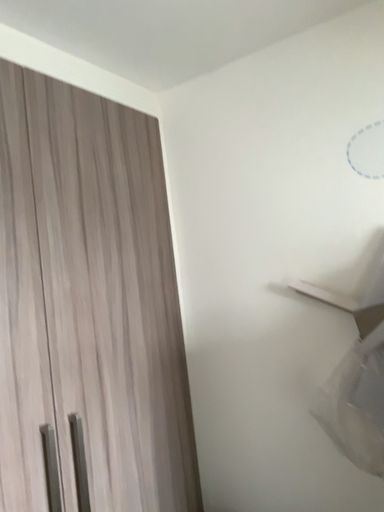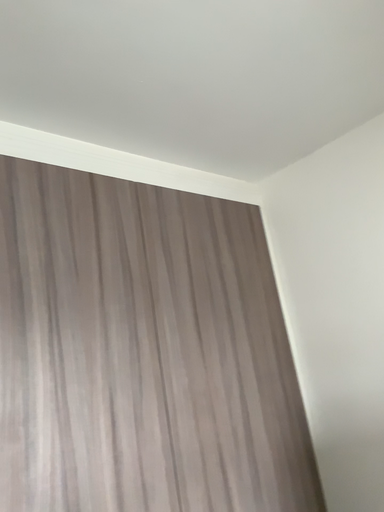
Question: How did the camera likely rotate when shooting the video?

Choices:
 (A) rotated downward
 (B) rotated upward

Answer: (B)